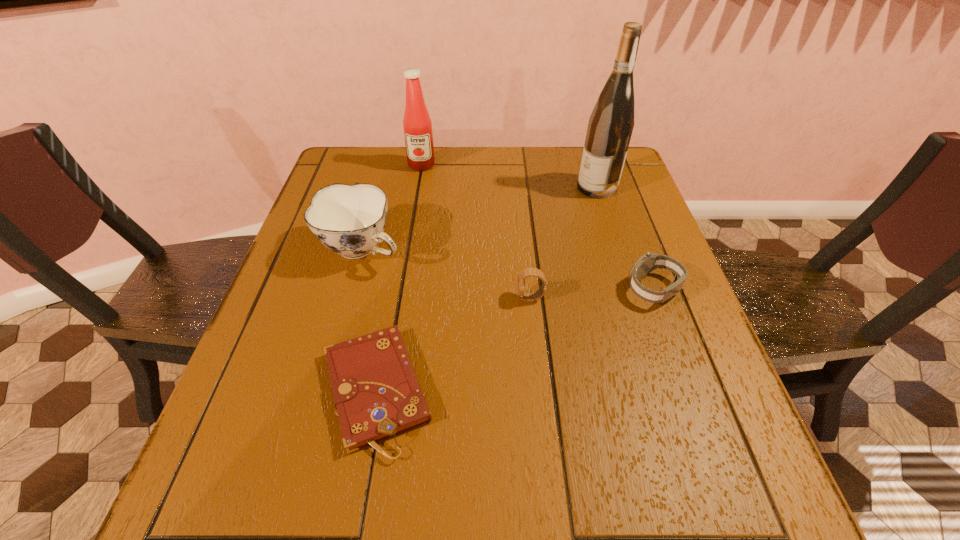
Find the location of a particular element. free location at the far left corner of the desktop is located at coordinates (347, 162).

You are a GUI agent. You are given a task and a screenshot of the screen. Output one action in this format:
    pyautogui.click(x=<x>, y=<y>)
    Task: Click on the vacant region between the shortest object and the third tallest object
    
    Given the screenshot: What is the action you would take?
    pyautogui.click(x=370, y=320)

Where is `free point between the right watch and the wine bottle`? This screenshot has height=540, width=960. free point between the right watch and the wine bottle is located at coordinates (625, 238).

You are a GUI agent. You are given a task and a screenshot of the screen. Output one action in this format:
    pyautogui.click(x=<x>, y=<y>)
    Task: Click on the free spot between the right watch and the tallest object
    Image resolution: width=960 pixels, height=540 pixels.
    Given the screenshot: What is the action you would take?
    pyautogui.click(x=625, y=238)

Locate an element on the screen. Image resolution: width=960 pixels, height=540 pixels. empty space that is in between the farthest object and the shortest object is located at coordinates (398, 278).

Identify the location of vacant point located between the nearest object and the fourth object from left to right. (453, 345).

You are a GUI agent. You are given a task and a screenshot of the screen. Output one action in this format:
    pyautogui.click(x=<x>, y=<y>)
    Task: Click on the blank region between the left watch and the shortest object
    The width and height of the screenshot is (960, 540).
    Given the screenshot: What is the action you would take?
    pyautogui.click(x=453, y=345)

At what (x,y) coordinates should I click in order to perform the action: click on free space between the second farthest object and the nearest object. Please return your answer as a coordinate pair (x, y). The width and height of the screenshot is (960, 540). Looking at the image, I should click on (487, 289).

The height and width of the screenshot is (540, 960). In order to click on empty location between the right watch and the chinaware in this screenshot , I will do `click(508, 269)`.

This screenshot has height=540, width=960. I want to click on empty space that is in between the farthest object and the tallest object, so click(x=510, y=176).